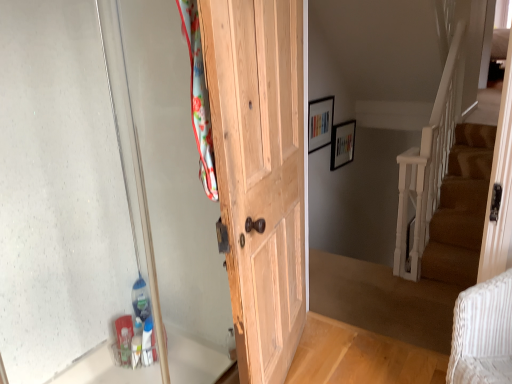
Question: From the image's perspective, is wooden picture frame at upper center, the 1th picture frame positioned from the left, located above or below natural wood door at center?

Choices:
 (A) below
 (B) above

Answer: (B)

Question: Is wooden picture frame at upper center, which is counted as the first picture frame, starting from the front, to the left or to the right of natural wood door at center in the image?

Choices:
 (A) left
 (B) right

Answer: (B)

Question: Which is farther from the transparent glass door at left?

Choices:
 (A) wooden picture frame at upper center, which is counted as the first picture frame, starting from the front
 (B) wooden picture frame at upper center, placed as the 1th picture frame when sorted from right to left
 (C) natural wood door at center

Answer: (B)

Question: Estimate the real-world distances between objects in this image. Which object is farther from the transparent glass door at left?

Choices:
 (A) natural wood door at center
 (B) wooden picture frame at upper center, the second picture frame positioned from the back
 (C) wooden picture frame at upper center, placed as the 1th picture frame when sorted from right to left

Answer: (C)